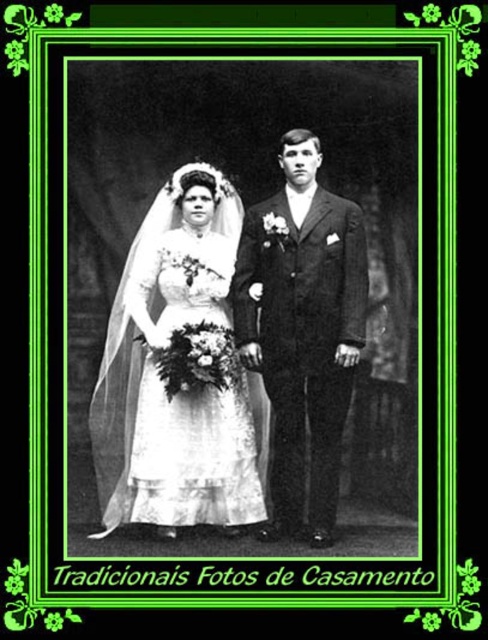
Question: Among these objects, which one is farthest from the camera?

Choices:
 (A) smooth black suit at center
 (B) white satin dress at center

Answer: (A)

Question: Where is white satin dress at center located in relation to smooth black suit at center in the image?

Choices:
 (A) below
 (B) above

Answer: (A)

Question: Does white satin dress at center appear on the right side of smooth black suit at center?

Choices:
 (A) no
 (B) yes

Answer: (A)

Question: Among these objects, which one is farthest from the camera?

Choices:
 (A) smooth black suit at center
 (B) white satin dress at center

Answer: (A)

Question: Can you confirm if white satin dress at center is smaller than smooth black suit at center?

Choices:
 (A) no
 (B) yes

Answer: (A)

Question: Which point appears farthest from the camera in this image?

Choices:
 (A) (326, 540)
 (B) (176, 448)

Answer: (A)